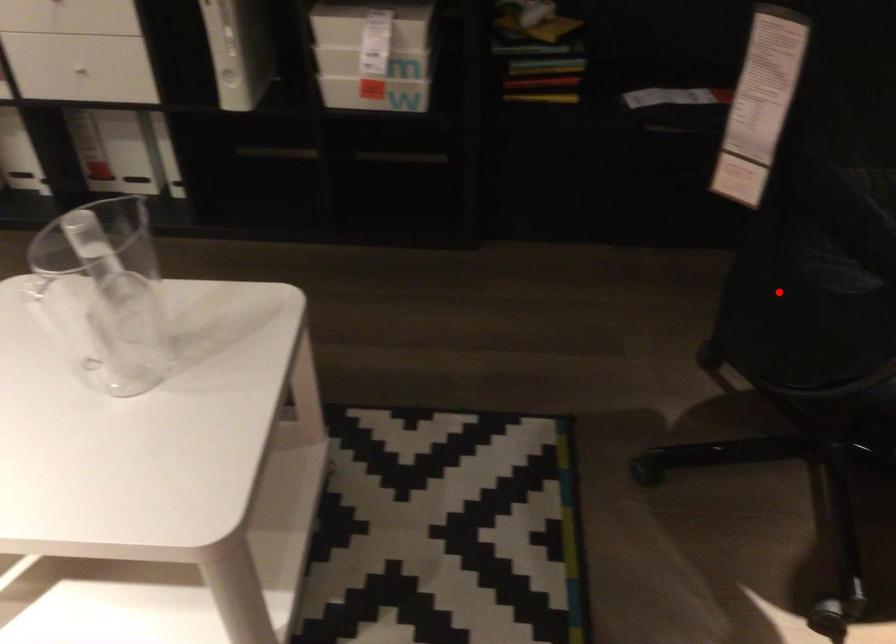
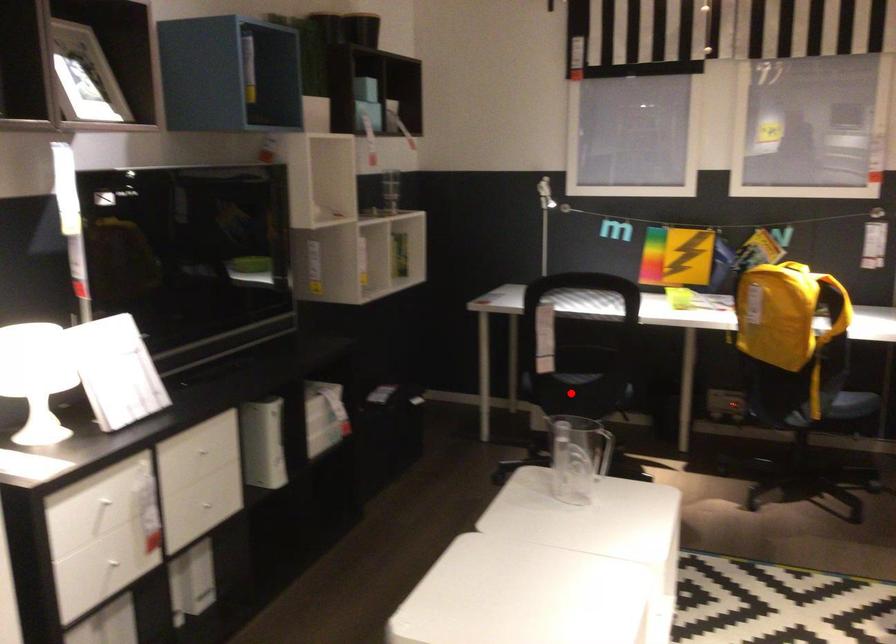
I am providing you with two images of the same scene from different viewpoints. A red point is marked on the first image and another point is marked on the second image. Does the point marked in image1 correspond to the same location as the one in image2?

Yes